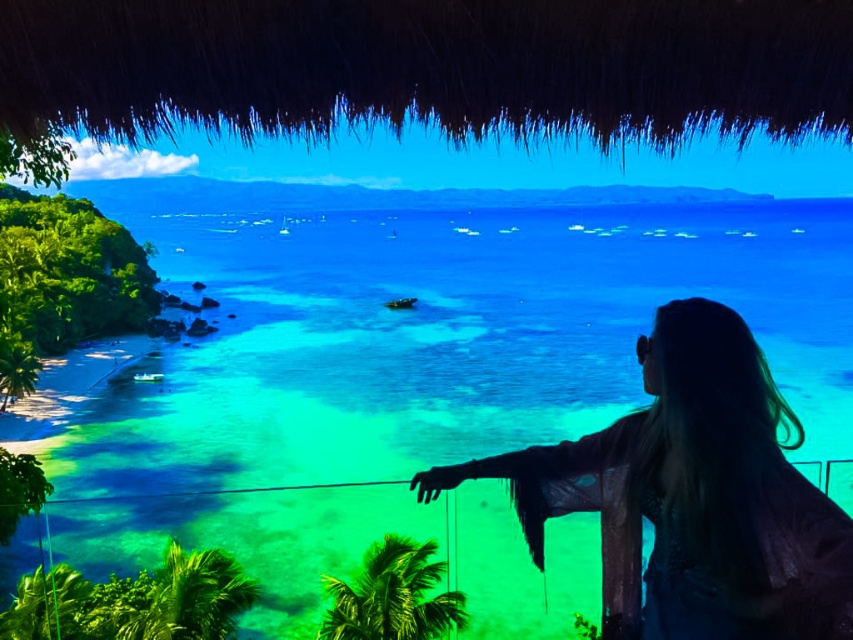
From the picture: Can you confirm if translucent blue water at center is positioned to the right of silky black hair at upper right?

No, translucent blue water at center is not to the right of silky black hair at upper right.

Is translucent blue water at center further to camera compared to silky black hair at upper right?

Yes, translucent blue water at center is behind silky black hair at upper right.

Does point (595, 276) come in front of point (740, 544)?

No, (595, 276) is behind (740, 544).

Locate an element on the screen. This screenshot has height=640, width=853. translucent blue water at center is located at coordinates (422, 385).